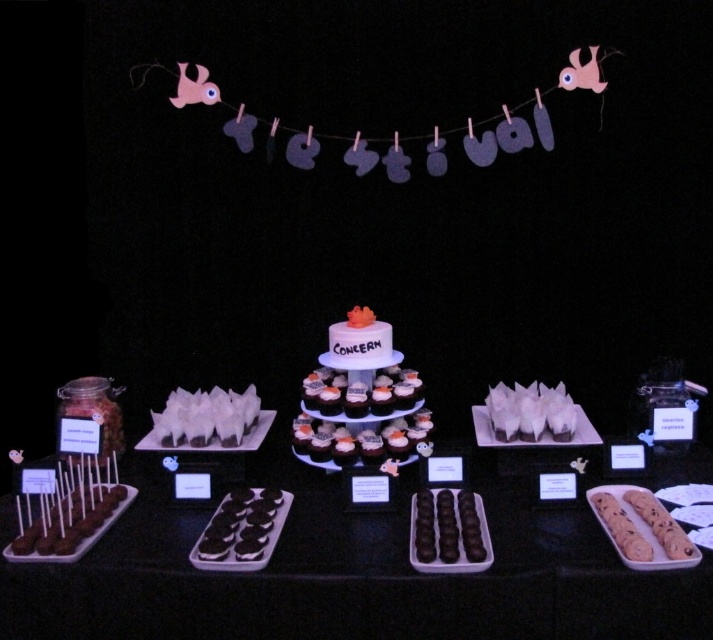
Is white matte tiered cake at center taller than white paper bag at center?

Yes.

Is white matte tiered cake at center to the left of white paper bag at center from the viewer's perspective?

Yes, white matte tiered cake at center is to the left of white paper bag at center.

In order to click on white matte tiered cake at center in this screenshot , I will do `click(359, 400)`.

Between smooth chocolate truffles at center and white paper cups at center, which one is positioned higher?

white paper cups at center is higher up.

Does smooth chocolate truffles at center appear on the right side of white paper cups at center?

Yes, smooth chocolate truffles at center is to the right of white paper cups at center.

Is point (456, 520) closer to camera compared to point (256, 408)?

Yes, point (456, 520) is in front of point (256, 408).

The width and height of the screenshot is (713, 640). Identify the location of smooth chocolate truffles at center. (448, 531).

Does chocolate cake at center appear on the right side of white matte tiered cake at center?

Incorrect, chocolate cake at center is not on the right side of white matte tiered cake at center.

Between chocolate cake at center and white matte tiered cake at center, which one has more height?

chocolate cake at center is taller.

Where is `chocolate cake at center`? chocolate cake at center is located at coordinates (366, 358).

Locate an element on the screen. chocolate cake at center is located at coordinates coord(366,358).